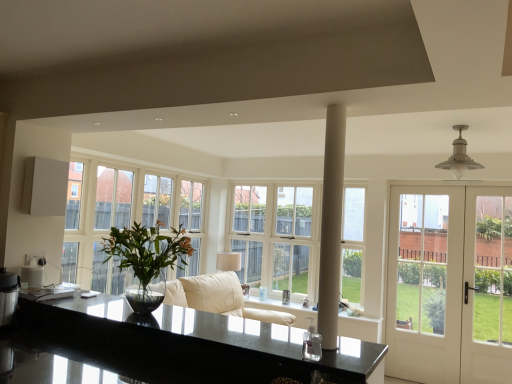
Question: From a real-world perspective, is white glossy door at right positioned above or below white smooth column at center?

Choices:
 (A) above
 (B) below

Answer: (B)

Question: In terms of height, does white glossy door at right look taller or shorter compared to white smooth column at center?

Choices:
 (A) short
 (B) tall

Answer: (B)

Question: Estimate the real-world distances between objects in this image. Which object is closer to the white smooth column at center?

Choices:
 (A) white glossy door at right
 (B) green glossy vase at left
 (C) black granite countertop at center
 (D) white glass window at center

Answer: (C)

Question: Considering the real-world distances, which object is farthest from the white glossy door at right?

Choices:
 (A) green glossy vase at left
 (B) white glass window at center
 (C) black granite countertop at center
 (D) white smooth column at center

Answer: (D)